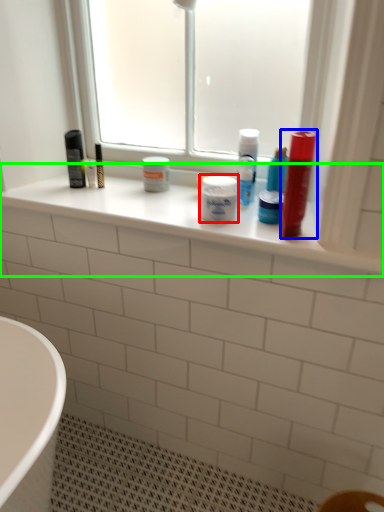
Question: Estimate the real-world distances between objects in this image. Which object is farther from toiletry (highlighted by a red box), mouthwash (highlighted by a blue box) or window sill (highlighted by a green box)?

Choices:
 (A) mouthwash
 (B) window sill

Answer: (B)